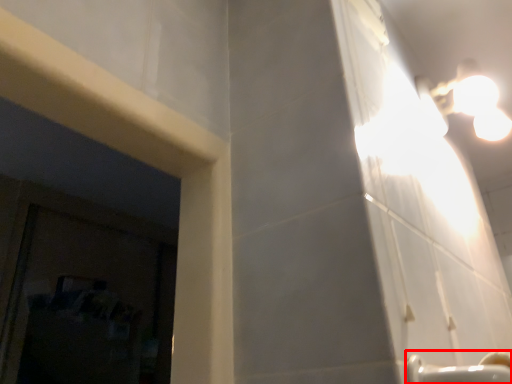
Question: From the image's perspective, where is faucet (annotated by the red box) located relative to light fixture?

Choices:
 (A) above
 (B) below

Answer: (B)